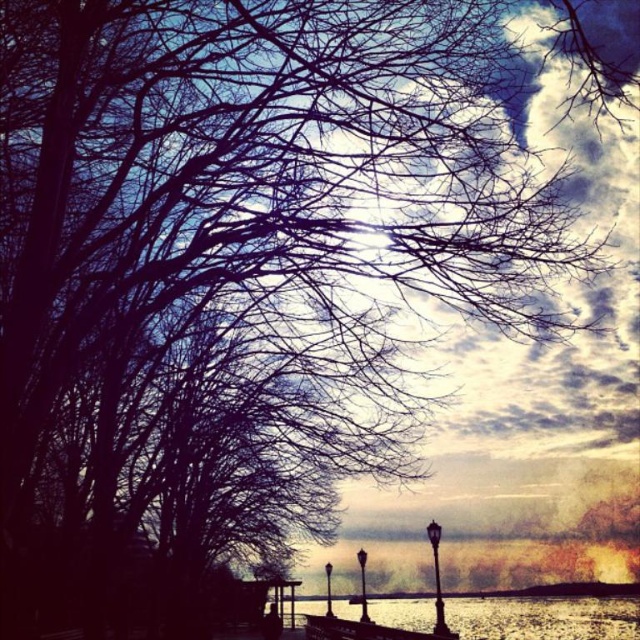
Is point (320, 611) farther from viewer compared to point (381, 637)?

Yes, it is.

Looking at this image, between reflective silver water at lower center and wooden dock at lower center, which one appears on the right side from the viewer's perspective?

Positioned to the right is reflective silver water at lower center.

Is point (492, 600) in front of point (326, 618)?

Yes, point (492, 600) is closer to viewer.

The width and height of the screenshot is (640, 640). Find the location of `reflective silver water at lower center`. reflective silver water at lower center is located at coordinates (544, 618).